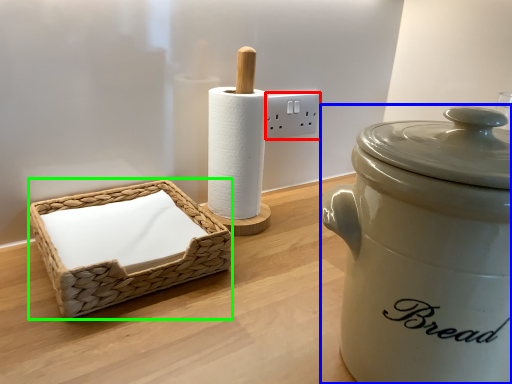
Question: Considering the real-world distances, which object is closest to electric outlet (highlighted by a red box)? rice cooker (highlighted by a blue box) or basket (highlighted by a green box).

Choices:
 (A) rice cooker
 (B) basket

Answer: (B)